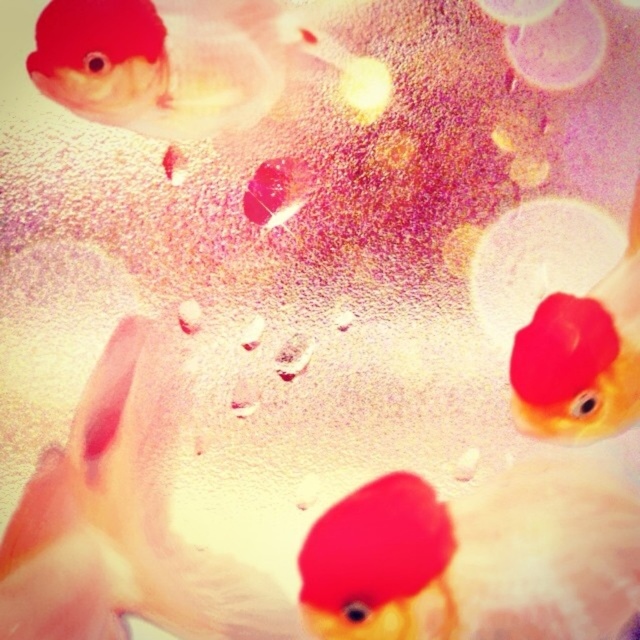
In the scene shown: Which is below, matte red goldfish at center or matte goldfish at upper right?

matte red goldfish at center

Does matte red goldfish at center appear under matte goldfish at upper right?

Indeed, matte red goldfish at center is positioned under matte goldfish at upper right.

Where is `matte red goldfish at center`? matte red goldfish at center is located at coordinates (380, 564).

Looking at this image, between matte red goldfish at upper right and matte goldfish at upper left, which one has less height?

matte goldfish at upper left is shorter.

The width and height of the screenshot is (640, 640). In order to click on matte red goldfish at upper right in this screenshot , I will do `click(476, 557)`.

Is matte red goldfish at upper right in front of matte red goldfish at center?

Yes, matte red goldfish at upper right is closer to the viewer.

Can you confirm if matte red goldfish at upper right is taller than matte red goldfish at center?

Yes, matte red goldfish at upper right is taller than matte red goldfish at center.

Is point (556, 477) positioned behind point (378, 616)?

Yes, point (556, 477) is farther from viewer.

This screenshot has height=640, width=640. What are the coordinates of `matte red goldfish at upper right` in the screenshot? It's located at (476, 557).